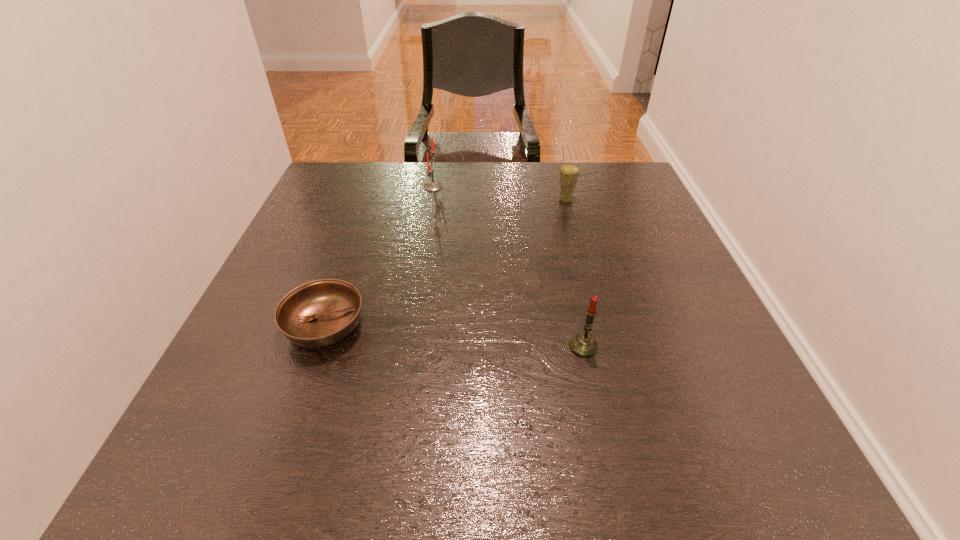
The width and height of the screenshot is (960, 540). I want to click on straw for drinking, so click(x=569, y=172).

The image size is (960, 540). Identify the location of the left candle. (431, 186).

Image resolution: width=960 pixels, height=540 pixels. Find the location of `the farther candle`. the farther candle is located at coordinates (431, 186).

At what (x,y) coordinates should I click in order to perform the action: click on the nearer candle. Please return your answer as a coordinate pair (x, y). This screenshot has width=960, height=540. Looking at the image, I should click on (583, 344).

This screenshot has width=960, height=540. I want to click on the shortest object, so click(x=320, y=313).

This screenshot has width=960, height=540. In order to click on the leftmost object in this screenshot , I will do [x=320, y=313].

You are a GUI agent. You are given a task and a screenshot of the screen. Output one action in this format:
    pyautogui.click(x=<x>, y=<y>)
    Task: Click on the vacant space located 0.220m on the front of the straw for drinking
    
    Given the screenshot: What is the action you would take?
    pyautogui.click(x=581, y=259)

Where is `free space located on the front-facing side of the left candle`? free space located on the front-facing side of the left candle is located at coordinates (549, 187).

Find the location of a particular element. The image size is (960, 540). vacant space located on the front of the right candle is located at coordinates (600, 424).

Where is `vacant space located 0.240m on the back of the soup bowl`? The width and height of the screenshot is (960, 540). vacant space located 0.240m on the back of the soup bowl is located at coordinates (359, 230).